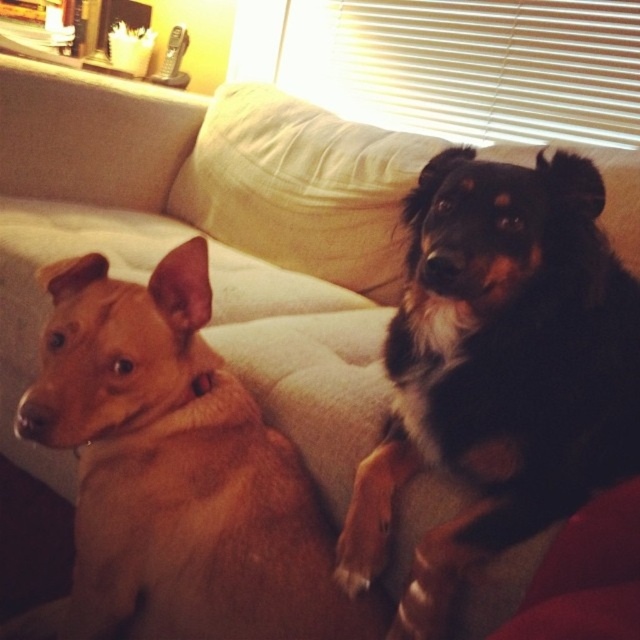
Measure the distance from black fur dog at center to beige fabric pillow at upper center.

A distance of 25.45 inches exists between black fur dog at center and beige fabric pillow at upper center.

Between point (595, 356) and point (388, 291), which one is positioned behind?

Point (388, 291)

Where is `black fur dog at center`? The height and width of the screenshot is (640, 640). black fur dog at center is located at coordinates (499, 371).